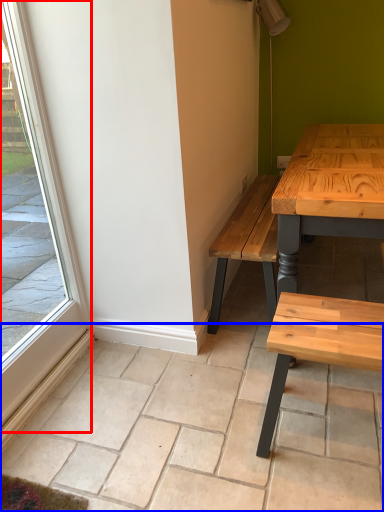
Question: Which object appears closest to the camera in this image, window (highlighted by a red box) or tile (highlighted by a blue box)?

Choices:
 (A) window
 (B) tile

Answer: (A)